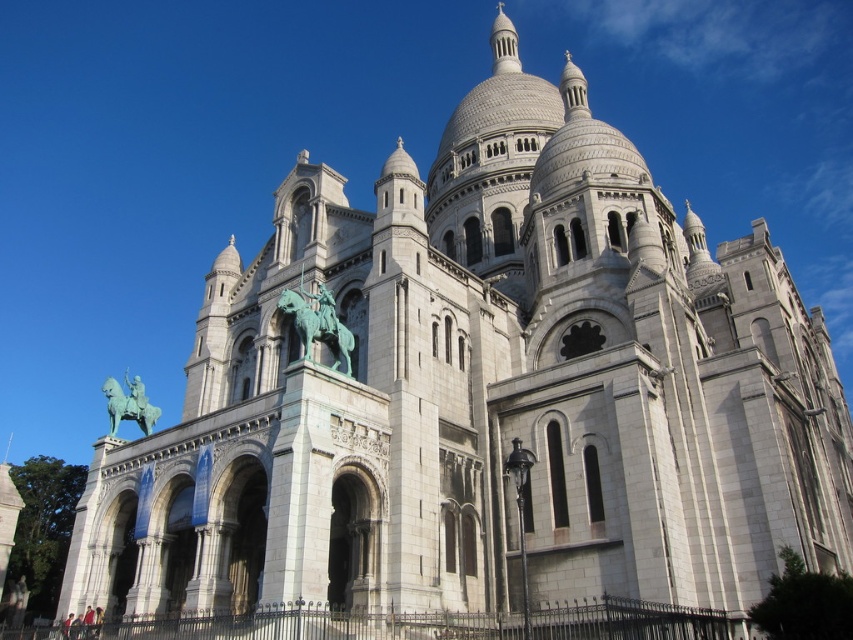
You are a tour guide standing at the base of the Basilica of the Sacred Heart of Paris. You notice two statues near the entrance. One is a green patinated bronze statue of a rider at center, and the other is a green patina statue at center. A tourist asks if they can take a photo that includes both statues without moving from their current spot. Can they do this, given that the statues are 28.03 meters apart?

The two statues are 28.03 meters apart. Since the tourist is standing at the base, they can likely capture both statues in a single photo without moving, as modern cameras and smartphones have wide enough lenses to accommodate such distances when the subject is within the field of view.

Looking at this image, you are a tourist standing in front of the Basilica of the Sacred Heart of Paris. You notice two statues at the center of the scene. One is labeled as the green patinated bronze statue of a rider at center, and the other is the green patina statue at center. Which statue is taller?

The green patina statue at center is taller than the green patinated bronze statue of a rider at center.